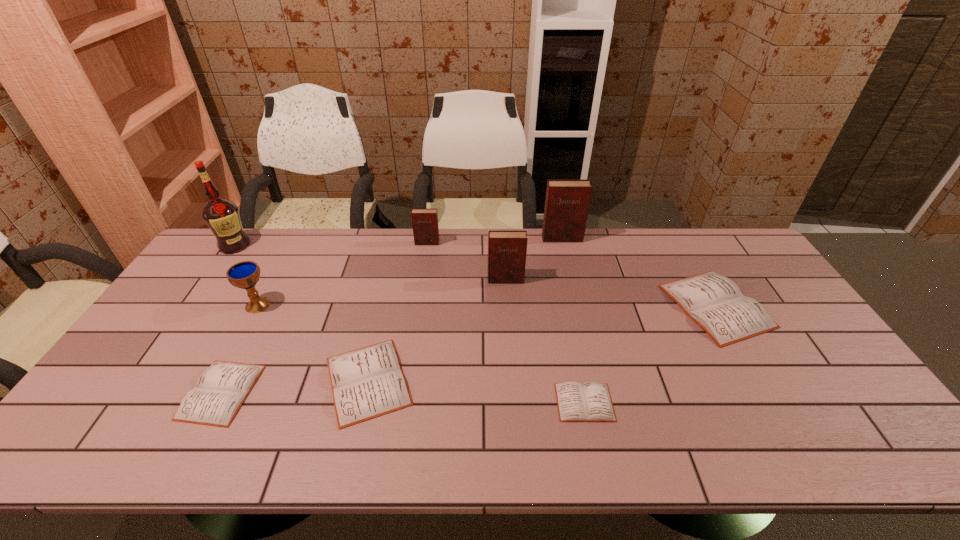
Where is `the sixth tallest object`? The height and width of the screenshot is (540, 960). the sixth tallest object is located at coordinates (716, 303).

Where is `the second biggest white diary`? the second biggest white diary is located at coordinates (368, 382).

Locate an element on the screen. This screenshot has width=960, height=540. the second white diary from left to right is located at coordinates (368, 382).

Find the location of a particular element. the second shortest diary is located at coordinates (221, 389).

I want to click on the third biggest white diary, so click(221, 389).

This screenshot has height=540, width=960. Find the location of `the shortest object`. the shortest object is located at coordinates (590, 402).

Identify the location of the smallest white diary. (590, 402).

Identify the location of vacant space positioned 0.220m on the label of the brown alcohol. (198, 299).

Find the location of a particular element. free space located on the front cover of the rightmost reddish-brown diary is located at coordinates (574, 292).

The height and width of the screenshot is (540, 960). I want to click on free region located 0.110m on the front cover of the second reddish-brown diary from left to right, so click(507, 308).